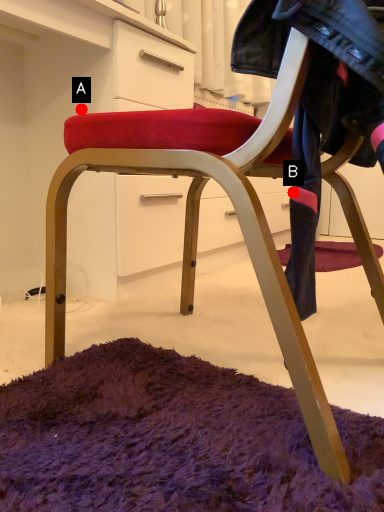
Question: Two points are circled on the image, labeled by A and B beside each circle. Among these points, which one is farthest from the camera?

Choices:
 (A) A is further
 (B) B is further

Answer: (A)